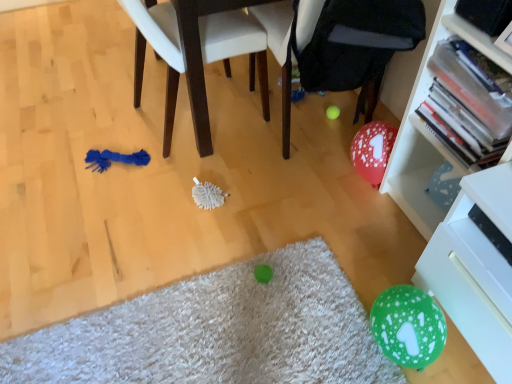
Image resolution: width=512 pixels, height=384 pixels. Find the location of `free space in front of white bristle brush at center`. free space in front of white bristle brush at center is located at coordinates (207, 232).